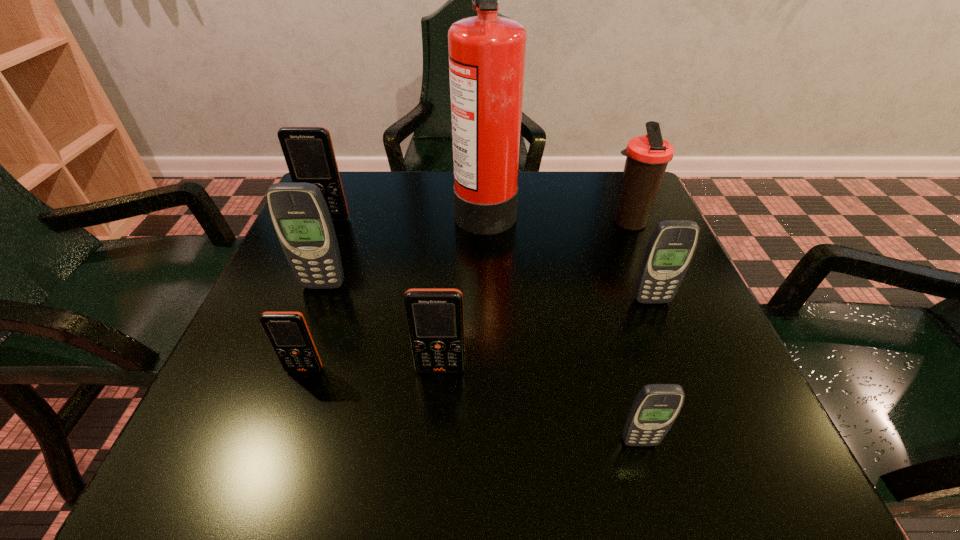
You are a GUI agent. You are given a task and a screenshot of the screen. Output one action in this format:
    pyautogui.click(x=<x>, y=<y>)
    Task: Click on the cellular telephone that is the third nearest to the rightmost cellular telephone
    The width and height of the screenshot is (960, 540).
    Given the screenshot: What is the action you would take?
    pyautogui.click(x=300, y=216)

Locate which orange cellular telephone ranks in proximity to the rightmost cellular telephone. Please provide its 2D coordinates. Your answer should be formatted as a tuple, i.e. [(x, y)], where the tuple contains the x and y coordinates of a point satisfying the conditions above.

[(435, 320)]

Choose which orange cellular telephone is the nearest neighbor to the second biggest orange cellular telephone. Please provide its 2D coordinates. Your answer should be formatted as a tuple, i.e. [(x, y)], where the tuple contains the x and y coordinates of a point satisfying the conditions above.

[(288, 332)]

Select which gray cellular telephone is the second closest to the biggest gray cellular telephone. Please provide its 2D coordinates. Your answer should be formatted as a tuple, i.e. [(x, y)], where the tuple contains the x and y coordinates of a point satisfying the conditions above.

[(655, 408)]

This screenshot has height=540, width=960. I want to click on the second closest gray cellular telephone to the farthest cellular telephone, so click(671, 247).

I want to click on free space that satisfies the following two spatial constraints: 1. on the front-facing side of the tallest object; 2. on the right side of the brown thermos bottle, so click(x=486, y=223).